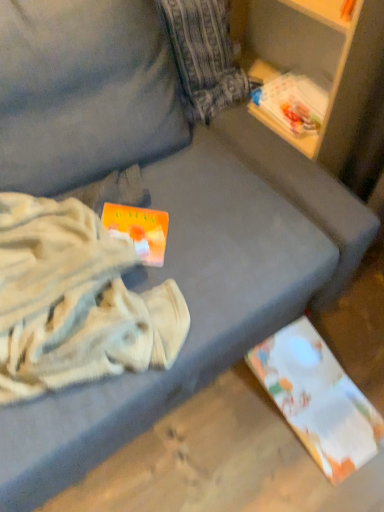
Describe the element at coordinates (75, 301) in the screenshot. This screenshot has height=512, width=384. I see `white cotton blanket at left` at that location.

I want to click on white paper at lower right, arranged as the 2th paperback book when viewed from the left, so click(x=318, y=399).

Considering the positions of points (107, 207) and (64, 254), is point (107, 207) closer to camera compared to point (64, 254)?

That is False.

Based on the photo, from the image's perspective, does orange matte paperback book at center-left, arranged as the 2th paperback book when ordered from the bottom, appear higher than white cotton blanket at left?

Yes.

Is orange matte paperback book at center-left, acting as the 1th paperback book starting from the top, wider or thinner than white cotton blanket at left?

Considering their sizes, orange matte paperback book at center-left, acting as the 1th paperback book starting from the top, looks slimmer than white cotton blanket at left.

Can you tell me how much orange matte paperback book at center-left, the 2th paperback book viewed from the right, and white cotton blanket at left differ in facing direction?

The angle between the facing direction of orange matte paperback book at center-left, the 2th paperback book viewed from the right, and the facing direction of white cotton blanket at left is 16.4 degrees.

Is white paper at lower right, acting as the first paperback book starting from the back, looking in the opposite direction of orange matte paperback book at center-left, acting as the 1th paperback book starting from the left?

No.

Between white paper at lower right, acting as the first paperback book starting from the back, and orange matte paperback book at center-left, arranged as the 2th paperback book when ordered from the bottom, which one appears on the right side from the viewer's perspective?

From the viewer's perspective, white paper at lower right, acting as the first paperback book starting from the back, appears more on the right side.

Consider the image. From a real-world perspective, which object stands above the other?

orange matte paperback book at center-left, positioned as the first paperback book in front-to-back order, from a real-world perspective.

How different are the orientations of white paper at lower right, which appears as the 2th paperback book when viewed from the front, and orange matte paperback book at center-left, arranged as the 2th paperback book when ordered from the bottom, in degrees?

53.8 degrees separate the facing orientations of white paper at lower right, which appears as the 2th paperback book when viewed from the front, and orange matte paperback book at center-left, arranged as the 2th paperback book when ordered from the bottom.

How distant is orange matte paperback book at center-left, positioned as the first paperback book in front-to-back order, from white paper at lower right, arranged as the 2th paperback book when viewed from the left?

orange matte paperback book at center-left, positioned as the first paperback book in front-to-back order, is 23.50 inches from white paper at lower right, arranged as the 2th paperback book when viewed from the left.

Is white paper at lower right, the second paperback book from the top, at the back of orange matte paperback book at center-left, acting as the 2th paperback book starting from the back?

No.

Which of these two, orange matte paperback book at center-left, positioned as the first paperback book in front-to-back order, or white paper at lower right, marked as the first paperback book in a bottom-to-top arrangement, is thinner?

orange matte paperback book at center-left, positioned as the first paperback book in front-to-back order.

Which object is more forward, orange matte paperback book at center-left, acting as the 2th paperback book starting from the back, or white paper at lower right, marked as the first paperback book in a bottom-to-top arrangement?

orange matte paperback book at center-left, acting as the 2th paperback book starting from the back, is in front.

Which is nearer, [305,425] or [49,237]?

Point [305,425].

Which object is thinner, white paper at lower right, the first paperback book when ordered from right to left, or white cotton blanket at left?

With smaller width is white paper at lower right, the first paperback book when ordered from right to left.

From a real-world perspective, is white paper at lower right, the first paperback book when ordered from right to left, above or below white cotton blanket at left?

white paper at lower right, the first paperback book when ordered from right to left, is below white cotton blanket at left.

Identify the location of clothing that is on the left side of white paper at lower right, acting as the first paperback book starting from the back. Image resolution: width=384 pixels, height=512 pixels. (75, 301).

Are white cotton blanket at left and white paper at lower right, the second paperback book from the top, beside each other?

There is a gap between white cotton blanket at left and white paper at lower right, the second paperback book from the top.

Considering the relative positions of white cotton blanket at left and white paper at lower right, arranged as the 2th paperback book when viewed from the left, in the image provided, is white cotton blanket at left to the right of white paper at lower right, arranged as the 2th paperback book when viewed from the left, from the viewer's perspective?

Incorrect, white cotton blanket at left is not on the right side of white paper at lower right, arranged as the 2th paperback book when viewed from the left.

Which object is further away from the camera taking this photo, white cotton blanket at left or white paper at lower right, the second paperback book from the top?

white paper at lower right, the second paperback book from the top, is further from the camera.

How far apart are white cotton blanket at left and orange matte paperback book at center-left, the 2th paperback book viewed from the right?

6.74 inches.

Considering the relative positions of white cotton blanket at left and orange matte paperback book at center-left, positioned as the first paperback book in front-to-back order, in the image provided, is white cotton blanket at left to the left or to the right of orange matte paperback book at center-left, positioned as the first paperback book in front-to-back order,?

white cotton blanket at left is positioned on orange matte paperback book at center-left, positioned as the first paperback book in front-to-back order,'s left side.

Who is taller, white cotton blanket at left or orange matte paperback book at center-left, the 2th paperback book viewed from the right?

With more height is white cotton blanket at left.

Find the location of a particular element. the 1st paperback book located beneath the white cotton blanket at left (from a real-world perspective) is located at coordinates (140, 229).

Find the location of `paperback book behind the orange matte paperback book at center-left, acting as the 1th paperback book starting from the top`. paperback book behind the orange matte paperback book at center-left, acting as the 1th paperback book starting from the top is located at coordinates (318, 399).

Considering their positions, is white cotton blanket at left positioned further to orange matte paperback book at center-left, arranged as the 2th paperback book when ordered from the bottom, than white paper at lower right, the second paperback book from the top?

white paper at lower right, the second paperback book from the top.

Estimate the real-world distances between objects in this image. Which object is further from white cotton blanket at left, orange matte paperback book at center-left, acting as the 1th paperback book starting from the top, or white paper at lower right, arranged as the 2th paperback book when viewed from the left?

white paper at lower right, arranged as the 2th paperback book when viewed from the left, lies further to white cotton blanket at left than the other object.

Which object lies nearer to the anchor point white paper at lower right, arranged as the 2th paperback book when viewed from the left, orange matte paperback book at center-left, acting as the 1th paperback book starting from the top, or white cotton blanket at left?

The object closer to white paper at lower right, arranged as the 2th paperback book when viewed from the left, is white cotton blanket at left.

Estimate the real-world distances between objects in this image. Which object is further from white paper at lower right, which appears as the 2th paperback book when viewed from the front, white cotton blanket at left or orange matte paperback book at center-left, acting as the 1th paperback book starting from the top?

orange matte paperback book at center-left, acting as the 1th paperback book starting from the top.

When comparing their distances from orange matte paperback book at center-left, acting as the 1th paperback book starting from the top, does white paper at lower right, the first paperback book when ordered from right to left, or white cotton blanket at left seem further?

white paper at lower right, the first paperback book when ordered from right to left, is positioned further to the anchor orange matte paperback book at center-left, acting as the 1th paperback book starting from the top.

Considering their positions, is white paper at lower right, acting as the first paperback book starting from the back, positioned further to white cotton blanket at left than orange matte paperback book at center-left, acting as the 1th paperback book starting from the left?

white paper at lower right, acting as the first paperback book starting from the back, is further to white cotton blanket at left.

This screenshot has width=384, height=512. I want to click on paperback book situated between white cotton blanket at left and white paper at lower right, which appears as the 2th paperback book when viewed from the front, from left to right, so click(140, 229).